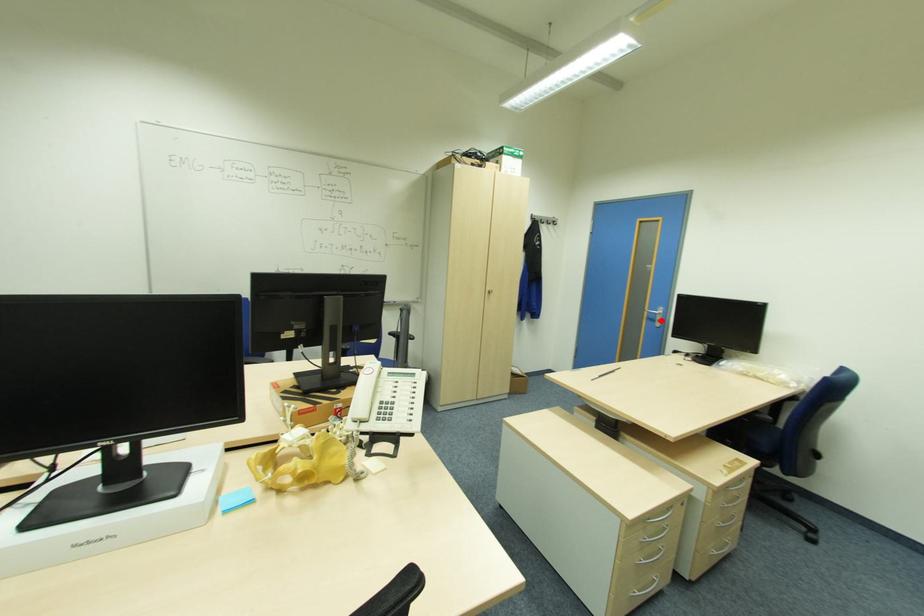
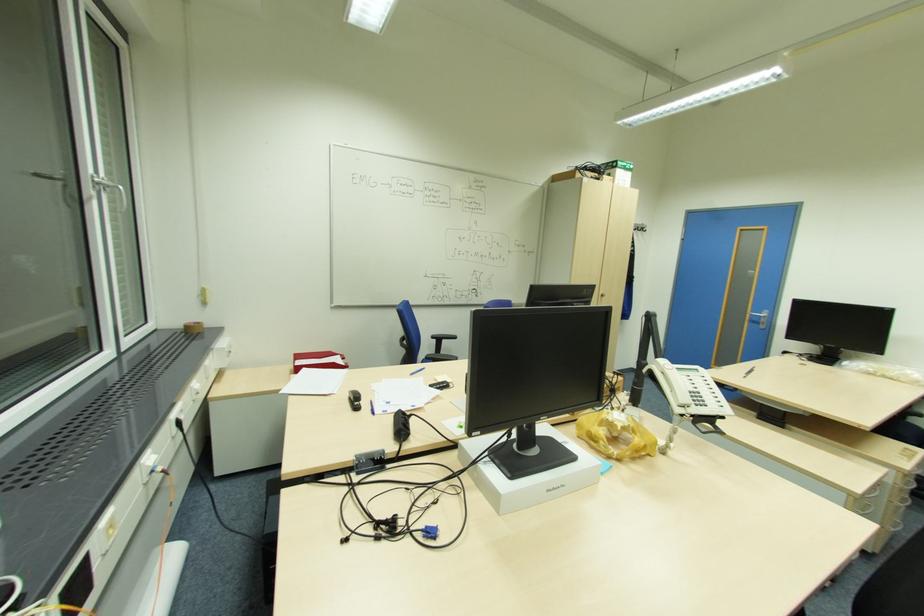
Locate, in the second image, the point that corresponds to the highlighted location in the first image.

(766, 323)